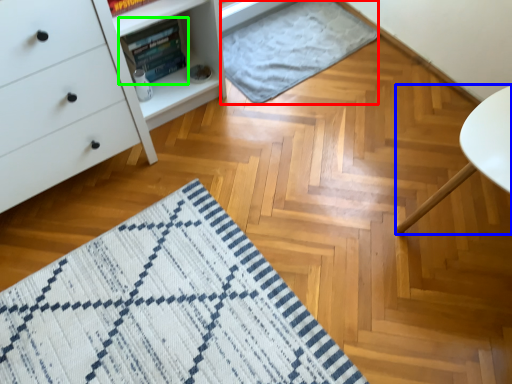
Question: Estimate the real-world distances between objects in this image. Which object is farther from blanket (highlighted by a red box), furniture (highlighted by a blue box) or book (highlighted by a green box)?

Choices:
 (A) furniture
 (B) book

Answer: (A)